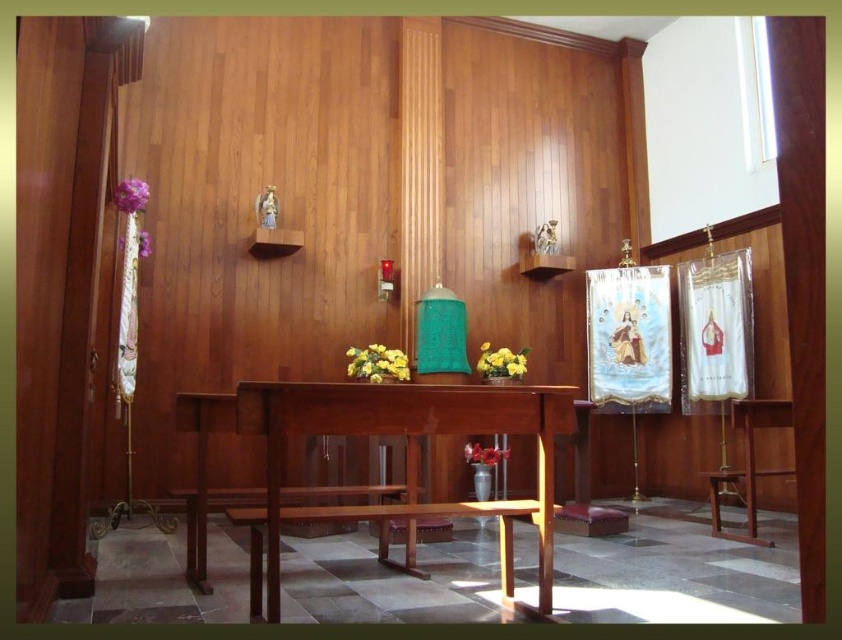
Does yellow matte flower at center appear on the right side of purple silk flower at upper left?

Indeed, yellow matte flower at center is positioned on the right side of purple silk flower at upper left.

Which is behind, point (493, 378) or point (137, 234)?

Point (493, 378)

This screenshot has height=640, width=842. What are the coordinates of `yellow matte flower at center` in the screenshot? It's located at (501, 362).

Does purple fabric flower at upper left have a lesser width compared to purple silk flower at upper left?

Yes, purple fabric flower at upper left is thinner than purple silk flower at upper left.

Is point (144, 204) closer to camera compared to point (142, 244)?

Yes, point (144, 204) is in front of point (142, 244).

The width and height of the screenshot is (842, 640). I want to click on purple fabric flower at upper left, so click(x=131, y=195).

Can you confirm if yellow matte flowers at center is bigger than yellow matte flower at center?

Indeed, yellow matte flowers at center has a larger size compared to yellow matte flower at center.

Who is lower down, yellow matte flowers at center or yellow matte flower at center?

yellow matte flowers at center

What do you see at coordinates (377, 364) in the screenshot? I see `yellow matte flowers at center` at bounding box center [377, 364].

In order to click on yellow matte flowers at center in this screenshot , I will do `click(377, 364)`.